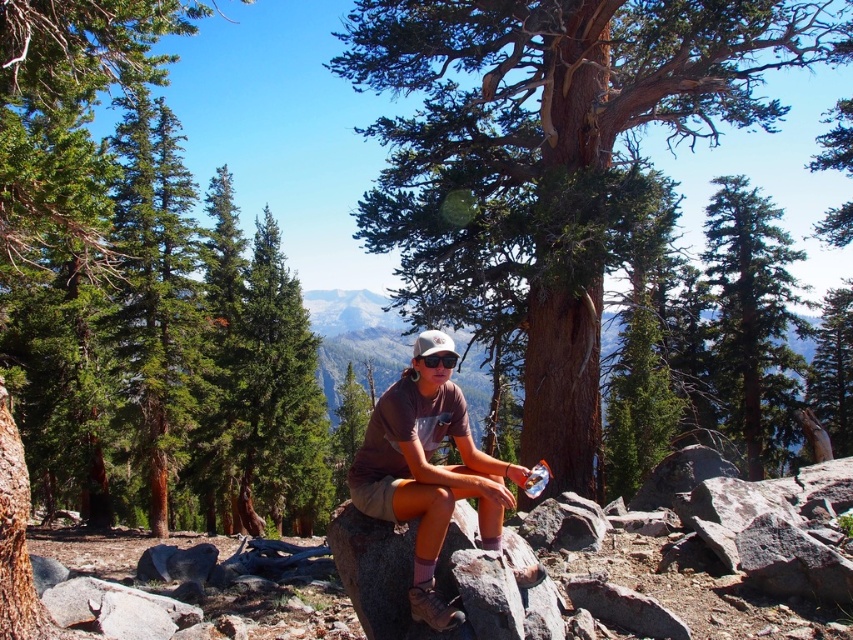
Does brown cotton shirt at center have a greater height compared to green coniferous tree at upper right?

Incorrect, brown cotton shirt at center's height is not larger of green coniferous tree at upper right's.

Looking at this image, does brown cotton shirt at center appear under green coniferous tree at upper right?

Yes, brown cotton shirt at center is below green coniferous tree at upper right.

Which is behind, point (378, 509) or point (751, 397)?

Positioned behind is point (751, 397).

Find the location of a particular element. This screenshot has width=853, height=640. brown cotton shirt at center is located at coordinates (428, 468).

Does smooth brown tree trunk at center appear on the left side of brown rough rock at center?

Yes, smooth brown tree trunk at center is to the left of brown rough rock at center.

Identify the location of smooth brown tree trunk at center. The width and height of the screenshot is (853, 640). (548, 156).

Where is `smooth brown tree trunk at center`? The height and width of the screenshot is (640, 853). smooth brown tree trunk at center is located at coordinates (548, 156).

Is smooth brown tree trunk at center smaller than green coniferous tree at upper right?

No, smooth brown tree trunk at center is not smaller than green coniferous tree at upper right.

Is the position of smooth brown tree trunk at center more distant than that of green coniferous tree at upper right?

No, it is not.

Is point (421, 141) positioned before point (776, 384)?

Yes.

This screenshot has width=853, height=640. I want to click on smooth brown tree trunk at center, so click(548, 156).